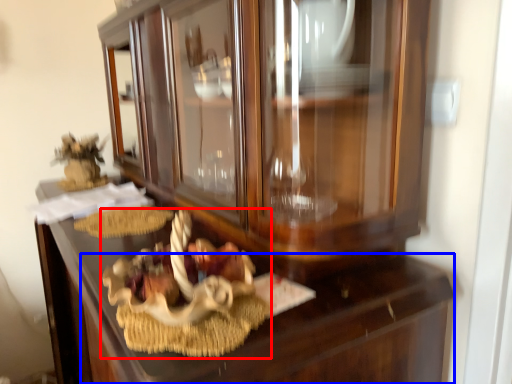
Question: Which of the following is the closest to the observer, stuff (highlighted by a red box) or drawer (highlighted by a blue box)?

Choices:
 (A) stuff
 (B) drawer

Answer: (B)